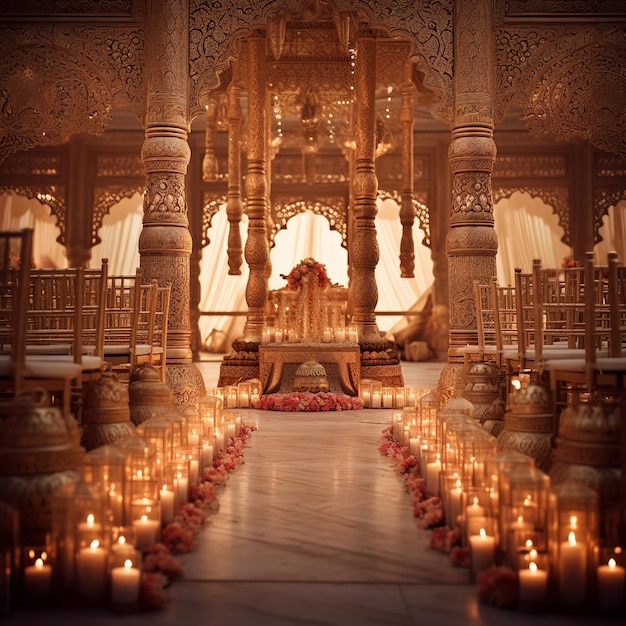
Where is `tile`? The width and height of the screenshot is (626, 626). tile is located at coordinates (302, 459).